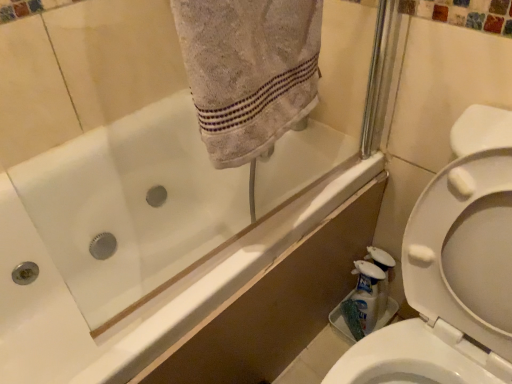
Question: In terms of width, does gray cotton towel at upper center look wider or thinner when compared to white glossy bottle at lower right, which is the 1th cleaning product from right to left?

Choices:
 (A) thin
 (B) wide

Answer: (B)

Question: From a real-world perspective, is gray cotton towel at upper center above or below white glossy bottle at lower right, which is the 1th cleaning product from right to left?

Choices:
 (A) below
 (B) above

Answer: (B)

Question: Considering the real-world distances, which object is closest to the white glossy bathtub at upper left?

Choices:
 (A) gray cotton towel at upper center
 (B) white plastic bottle at lower right, placed as the 2th cleaning product when sorted from right to left
 (C) white glossy bottle at lower right, the 2th cleaning product in the left-to-right sequence

Answer: (B)

Question: Considering the real-world distances, which object is closest to the white glossy bathtub at upper left?

Choices:
 (A) white glossy bottle at lower right, the 2th cleaning product in the left-to-right sequence
 (B) gray cotton towel at upper center
 (C) white plastic bottle at lower right, placed as the first cleaning product when sorted from left to right

Answer: (C)